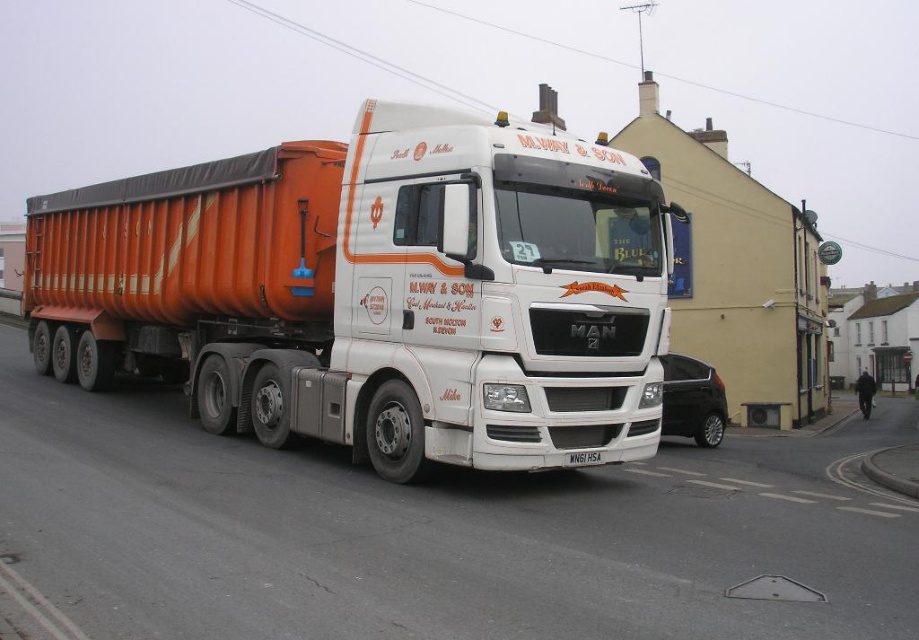
Is orange metallic trailer at left further to the viewer compared to white plastic license plate at center?

No, orange metallic trailer at left is in front of white plastic license plate at center.

Between point (625, 330) and point (587, 454), which one is positioned in front?

Positioned in front is point (587, 454).

Is point (580, 376) closer to camera compared to point (573, 461)?

No.

This screenshot has width=919, height=640. I want to click on orange metallic trailer at left, so click(x=377, y=291).